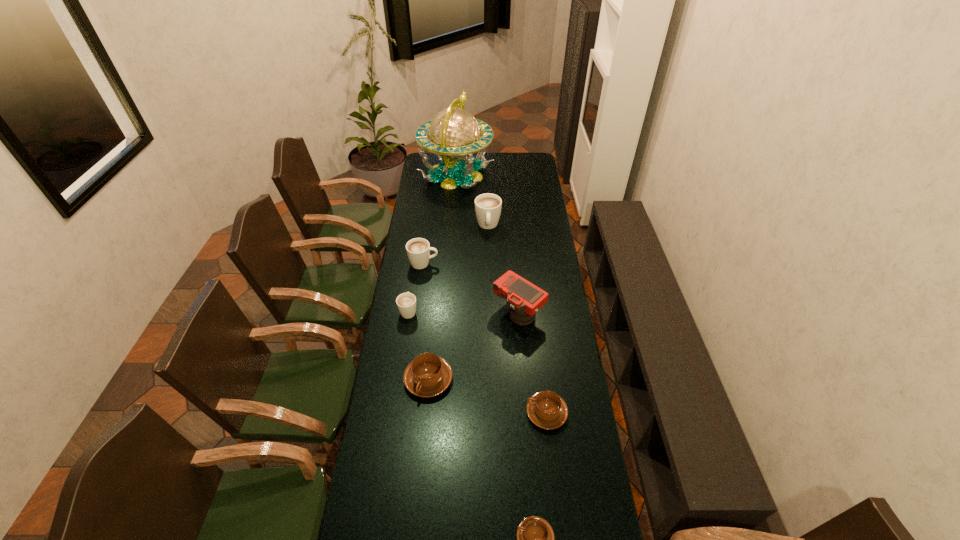
Locate an element on the screen. vacant region located 0.050m on the side of the second smallest brown cappuccino with the handle is located at coordinates (512, 413).

This screenshot has height=540, width=960. Find the location of `vacant point located 0.150m on the side of the second smallest brown cappuccino with the handle`. vacant point located 0.150m on the side of the second smallest brown cappuccino with the handle is located at coordinates (484, 413).

This screenshot has height=540, width=960. In order to click on object that is at the far edge in this screenshot , I will do `click(454, 133)`.

I want to click on globe that is at the left edge, so click(454, 133).

Where is `camera at the right edge`? Image resolution: width=960 pixels, height=540 pixels. camera at the right edge is located at coordinates (524, 298).

The width and height of the screenshot is (960, 540). What are the coordinates of `cappuccino that is positioned at the right edge` in the screenshot? It's located at (547, 410).

This screenshot has width=960, height=540. I want to click on object that is at the far left corner, so click(x=454, y=133).

You are a GUI agent. You are given a task and a screenshot of the screen. Output one action in this format:
    pyautogui.click(x=<x>, y=<y>)
    Task: Click on the vacant space at the far edge of the desktop
    The height and width of the screenshot is (540, 960).
    Given the screenshot: What is the action you would take?
    pyautogui.click(x=511, y=165)

In the image, there is a desktop. Where is `vacant space at the left edge`? The height and width of the screenshot is (540, 960). vacant space at the left edge is located at coordinates (405, 406).

In the image, there is a desktop. Where is `blank space at the right edge`? The image size is (960, 540). blank space at the right edge is located at coordinates (569, 454).